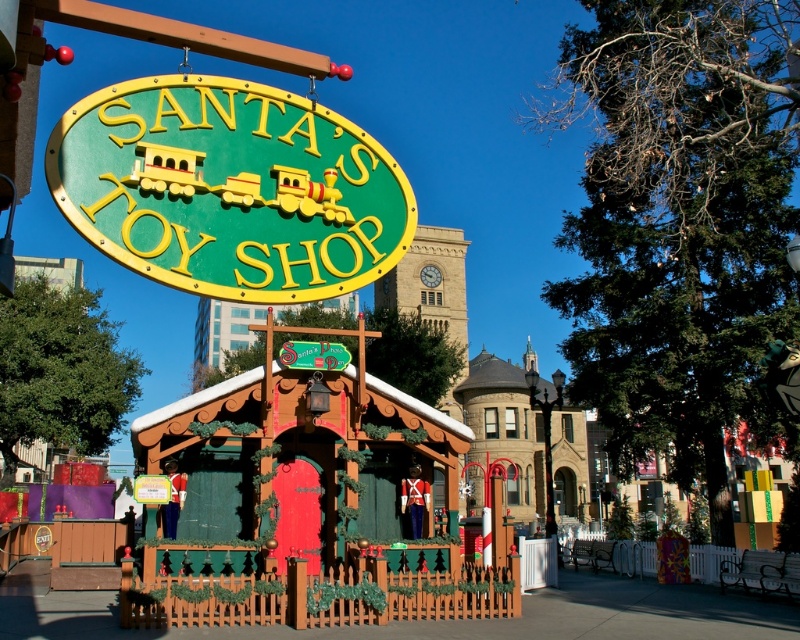
You are a visitor at the festive scene and want to locate both the green matte sign at upper center and the green plastic sign at center. Which of these two signs is taller?

The green matte sign at upper center is much taller than the green plastic sign at center.

You are designing a layout for a holiday market and need to place a new banner. The banner must be placed above the wooden cabin at center but below the green matte sign at upper center. Is this possible given their sizes?

The wooden cabin at center is larger than the green matte sign at upper center, so placing a banner above the cabin but below the sign may not be feasible due to the cabin being bigger in size.